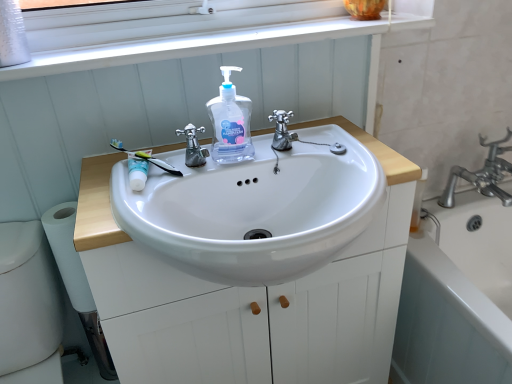
Question: In terms of size, does white matte toilet paper at lower left appear bigger or smaller than translucent plastic hand soap at center?

Choices:
 (A) small
 (B) big

Answer: (B)

Question: From the image's perspective, is white matte toilet paper at lower left located above or below translucent plastic hand soap at center?

Choices:
 (A) above
 (B) below

Answer: (B)

Question: Based on their relative distances, which object is nearer to the polished chrome faucet at center, which is the 2th tap in left-to-right order?

Choices:
 (A) translucent plastic hand soap at center
 (B) white glossy toilet bowl at lower left
 (C) polished chrome faucet at center, which is counted as the 1th tap, starting from the left
 (D) white ceramic bathtub at lower right
 (E) white matte cabinet at center

Answer: (A)

Question: Based on their relative distances, which object is nearer to the white glossy toilet bowl at lower left?

Choices:
 (A) white glossy mouthwash at upper left
 (B) white matte cabinet at center
 (C) white matte toilet paper at lower left
 (D) green rubber toothbrush at upper left
 (E) polished chrome faucet at center, the second tap positioned from the right

Answer: (C)